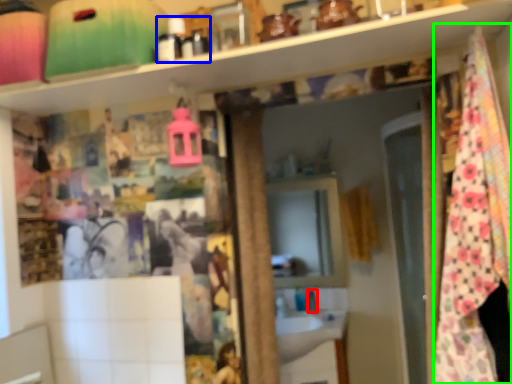
Question: Which object is the closest to the faucet (highlighted by a red box)? Choose among these: toiletry (highlighted by a blue box) or blanket (highlighted by a green box).

Choices:
 (A) toiletry
 (B) blanket

Answer: (B)